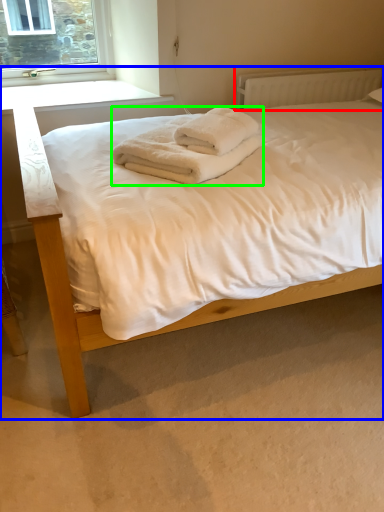
Question: Which object is the closest to the radiator (highlighted by a red box)? Choose among these: bed (highlighted by a blue box) or bath towel (highlighted by a green box).

Choices:
 (A) bed
 (B) bath towel

Answer: (B)